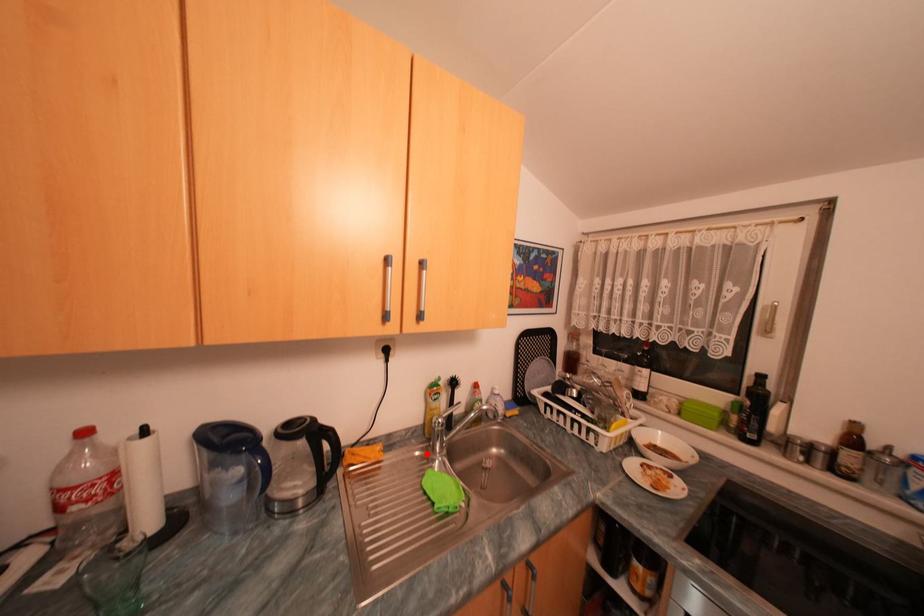
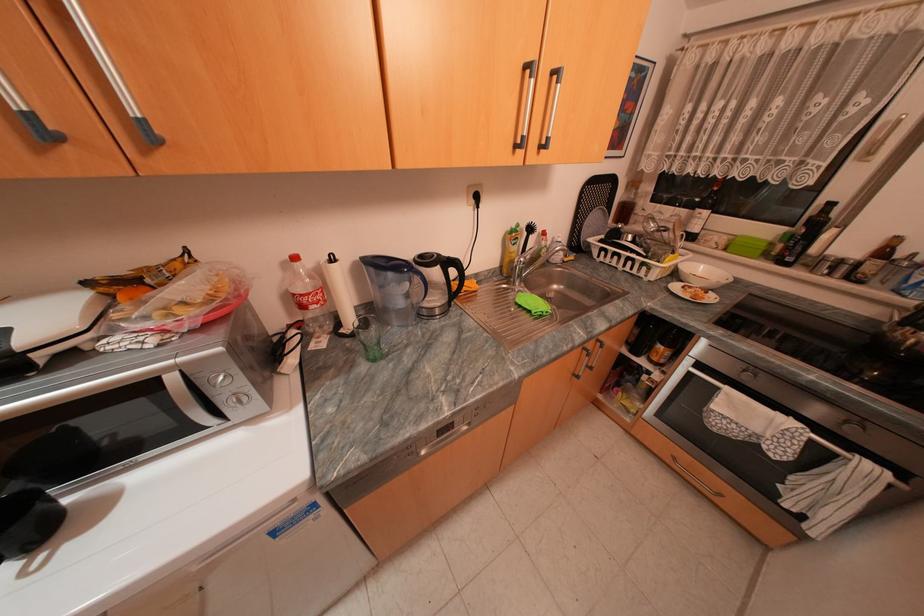
Question: I am providing you with two images of the same scene from different viewpoints. Image1 has a red point marked. In image2, the corresponding 3D location appears at what relative position? Reply with the corresponding letter.

Choices:
 (A) Closer
 (B) Farther

Answer: (A)